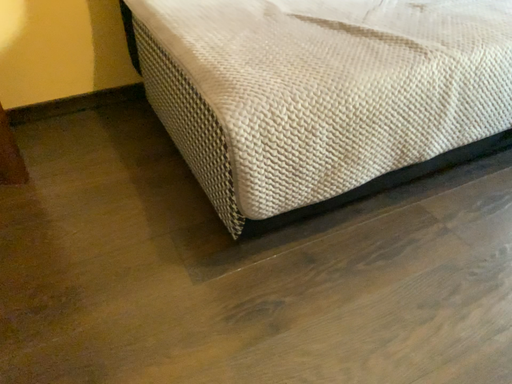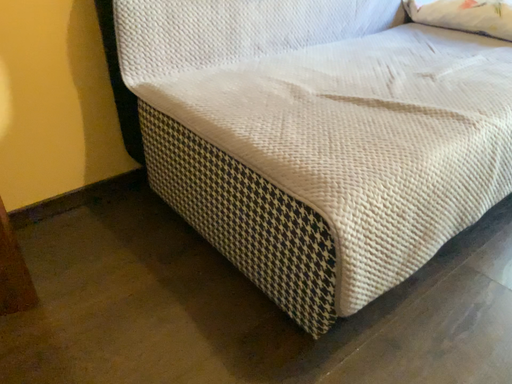
Question: How did the camera likely rotate when shooting the video?

Choices:
 (A) rotated upward
 (B) rotated downward

Answer: (A)